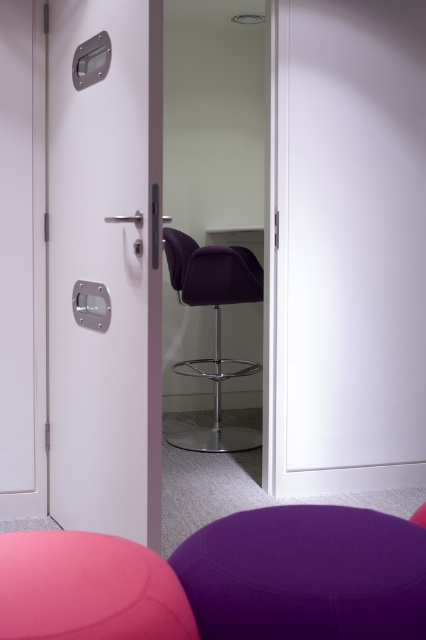
Is purple fabric bar stool at center further to the viewer compared to purple velvet swivel chair at center?

No, purple fabric bar stool at center is in front of purple velvet swivel chair at center.

Between purple fabric bar stool at center and purple velvet swivel chair at center, which one has more height?

purple velvet swivel chair at center

Between point (19, 627) and point (169, 257), which one is positioned in front?

Point (19, 627) is in front.

Locate an element on the screen. The width and height of the screenshot is (426, 640). purple fabric bar stool at center is located at coordinates (88, 588).

Is white glossy door at left below purple fabric bar stool at lower center?

No.

Is point (161, 308) positioned after point (236, 595)?

Yes, point (161, 308) is behind point (236, 595).

Locate an element on the screen. The image size is (426, 640). white glossy door at left is located at coordinates (106, 272).

Is white glossy door at left above purple velvet swivel chair at center?

Yes, white glossy door at left is above purple velvet swivel chair at center.

Is point (55, 508) behind point (196, 266)?

No.

At what (x,y) coordinates should I click in order to perform the action: click on white glossy door at left. Please return your answer as a coordinate pair (x, y). Looking at the image, I should click on (106, 272).